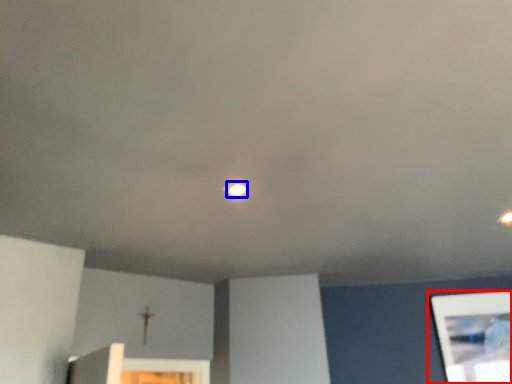
Question: Which object appears farthest to the camera in this image, picture frame (highlighted by a red box) or light (highlighted by a blue box)?

Choices:
 (A) picture frame
 (B) light

Answer: (A)